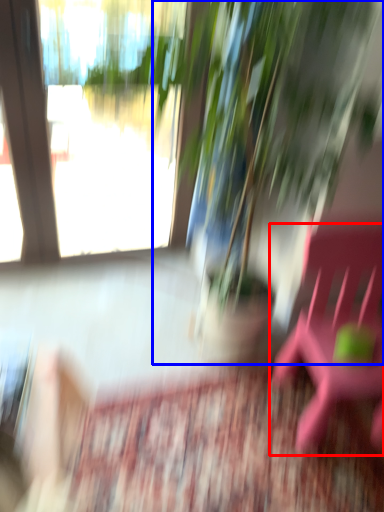
Question: Among these objects, which one is farthest to the camera, beach chair (highlighted by a red box) or houseplant (highlighted by a blue box)?

Choices:
 (A) beach chair
 (B) houseplant

Answer: (B)